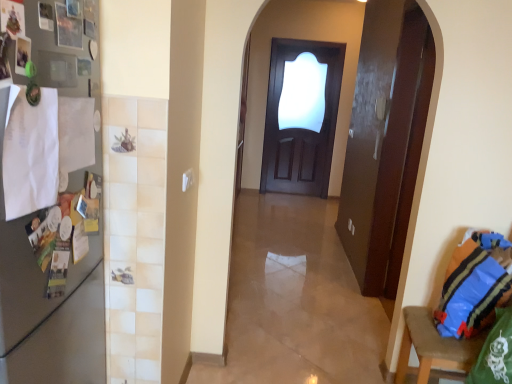
The image size is (512, 384). Find the location of `free spot in front of dark wood door at center`. free spot in front of dark wood door at center is located at coordinates (295, 203).